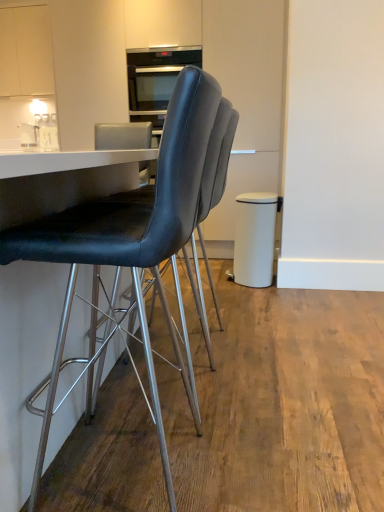
Question: Is there a large distance between black leather chair at center, placed as the 2th chair when sorted from front to back, and white matte trash can at right?

Choices:
 (A) yes
 (B) no

Answer: (A)

Question: Considering the relative sizes of black leather chair at center, placed as the 2th chair when sorted from front to back, and white matte trash can at right in the image provided, is black leather chair at center, placed as the 2th chair when sorted from front to back, wider than white matte trash can at right?

Choices:
 (A) no
 (B) yes

Answer: (B)

Question: Considering the relative sizes of black leather chair at center, the 1th chair from the back, and white matte trash can at right in the image provided, is black leather chair at center, the 1th chair from the back, smaller than white matte trash can at right?

Choices:
 (A) yes
 (B) no

Answer: (B)

Question: Can you confirm if black leather chair at center, placed as the 2th chair when sorted from front to back, is taller than white matte trash can at right?

Choices:
 (A) yes
 (B) no

Answer: (A)

Question: From the image's perspective, is black leather chair at center, the 1th chair from the back, above white matte trash can at right?

Choices:
 (A) no
 (B) yes

Answer: (A)

Question: From their relative heights in the image, would you say black leather chair at center, arranged as the 1th chair when viewed from the front, is taller or shorter than white matte cabinet at upper left?

Choices:
 (A) short
 (B) tall

Answer: (B)

Question: Considering the positions of black leather chair at center, placed as the second chair when sorted from back to front, and white matte cabinet at upper left in the image, is black leather chair at center, placed as the second chair when sorted from back to front, wider or thinner than white matte cabinet at upper left?

Choices:
 (A) wide
 (B) thin

Answer: (A)

Question: Does point (69, 304) appear closer or farther from the camera than point (26, 22)?

Choices:
 (A) closer
 (B) farther

Answer: (A)

Question: From the image's perspective, is black leather chair at center, placed as the second chair when sorted from back to front, positioned above or below white matte cabinet at upper left?

Choices:
 (A) below
 (B) above

Answer: (A)

Question: From a real-world perspective, relative to white matte cabinet at upper left, is white glossy salt shaker at upper left, the 2th appliance from the front, vertically above or below?

Choices:
 (A) above
 (B) below

Answer: (B)

Question: In the image, is white glossy salt shaker at upper left, acting as the first appliance starting from the left, positioned in front of or behind white matte cabinet at upper left?

Choices:
 (A) behind
 (B) front

Answer: (A)

Question: Is white glossy salt shaker at upper left, which is the 2th appliance from right to left, bigger or smaller than white matte cabinet at upper left?

Choices:
 (A) small
 (B) big

Answer: (A)

Question: Visually, is white glossy salt shaker at upper left, which is the 2th appliance from right to left, positioned to the left or to the right of white matte cabinet at upper left?

Choices:
 (A) right
 (B) left

Answer: (A)

Question: From a real-world perspective, is white glossy salt shaker at upper left, acting as the first appliance starting from the left, positioned above or below black leather chair at center, the 1th chair from the back?

Choices:
 (A) above
 (B) below

Answer: (A)

Question: From the image's perspective, is white glossy salt shaker at upper left, the 2th appliance from the front, located above or below black leather chair at center, the 1th chair from the back?

Choices:
 (A) below
 (B) above

Answer: (B)